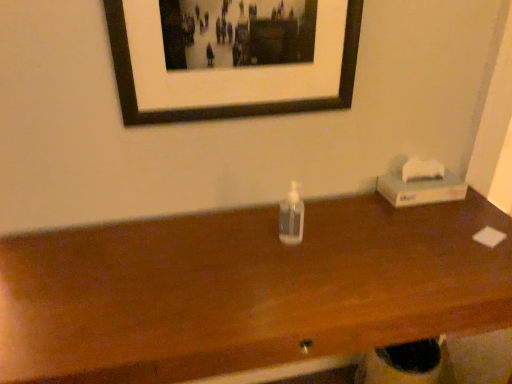
Identify the location of vacant space to the right of transparent plastic bottle at center. (349, 236).